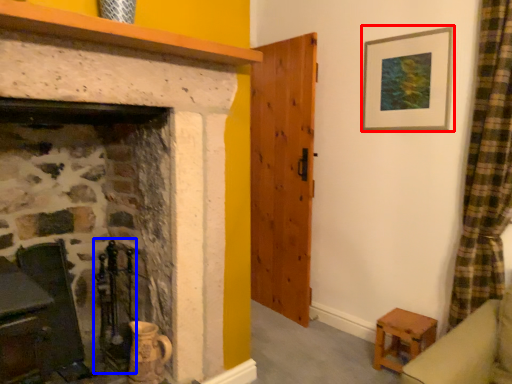
Question: Which point is closer to the camera, picture frame (highlighted by a red box) or chair (highlighted by a blue box)?

Choices:
 (A) picture frame
 (B) chair

Answer: (B)